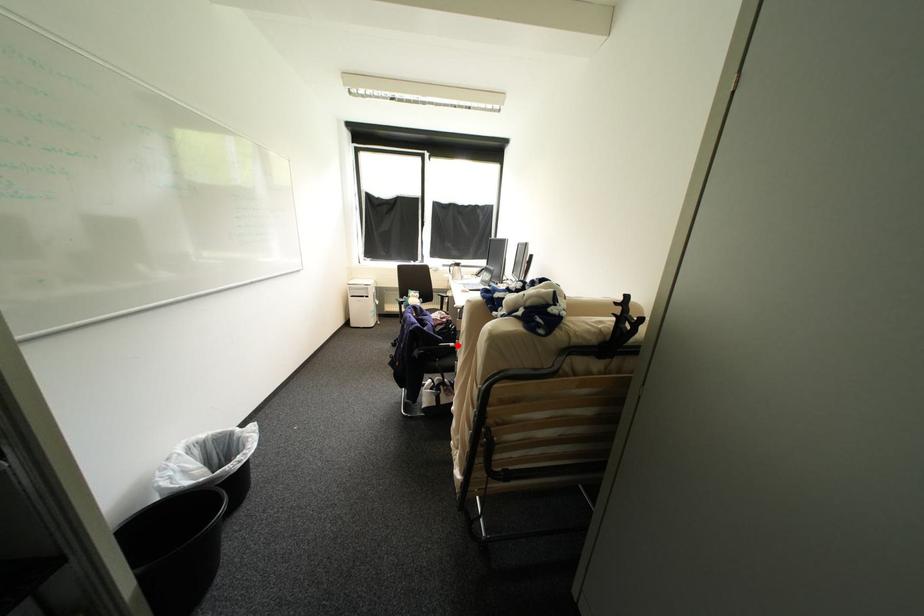
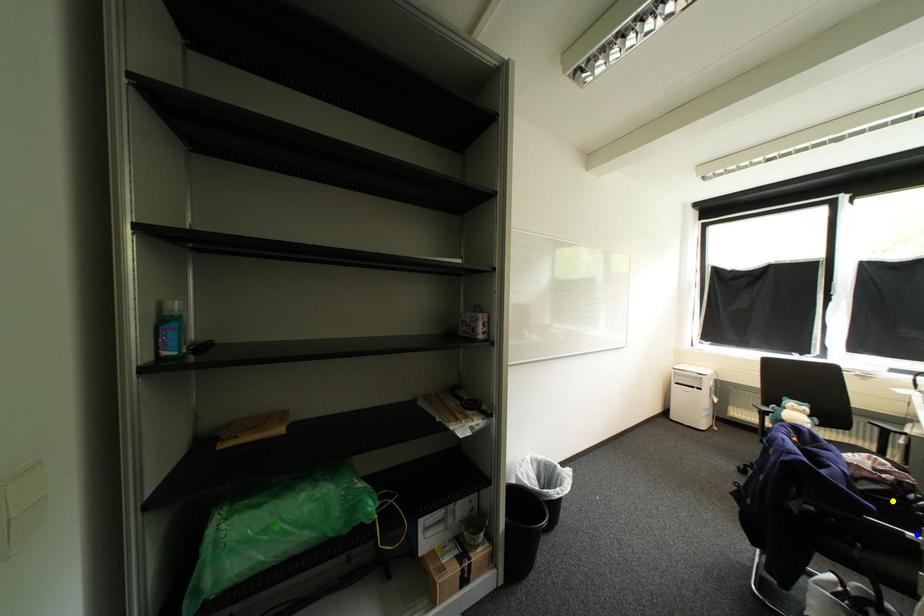
Question: I am providing you with two images of the same scene from different viewpoints. A red point is marked on the first image. You are given multiple points on the second image. Which spot in image 2 lines up with the point in image 1?

Choices:
 (A) green point
 (B) yellow point
 (C) blue point

Answer: (C)